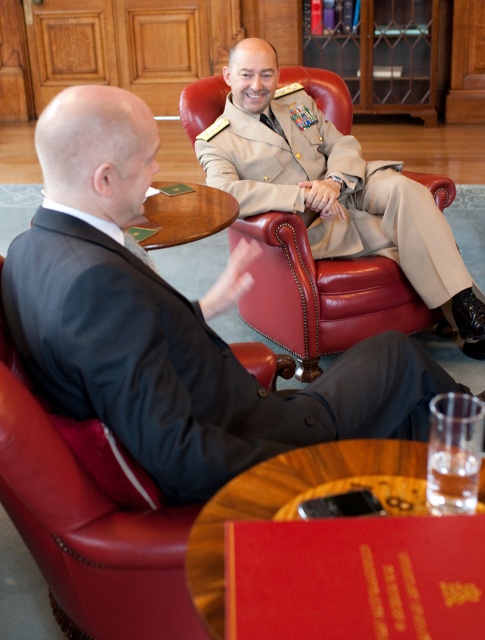
Who is more forward, (448, 204) or (219, 627)?

Point (219, 627) is in front.

The image size is (485, 640). What are the coordinates of `leather armchair at center` in the screenshot? It's located at (322, 292).

The height and width of the screenshot is (640, 485). What are the coordinates of `leather armchair at center` in the screenshot? It's located at (322, 292).

Is point (155, 560) more distant than point (268, 269)?

No.

Is leather armchair at left smaller than leather armchair at center?

Yes.

Is point (181, 577) more distant than point (325, 100)?

No, it is in front of (325, 100).

Identify the location of leather armchair at left. This screenshot has width=485, height=640. (91, 532).

Is point (6, 364) positioned behind point (232, 497)?

Yes, point (6, 364) is farther from viewer.

Image resolution: width=485 pixels, height=640 pixels. I want to click on leather armchair at left, so click(91, 532).